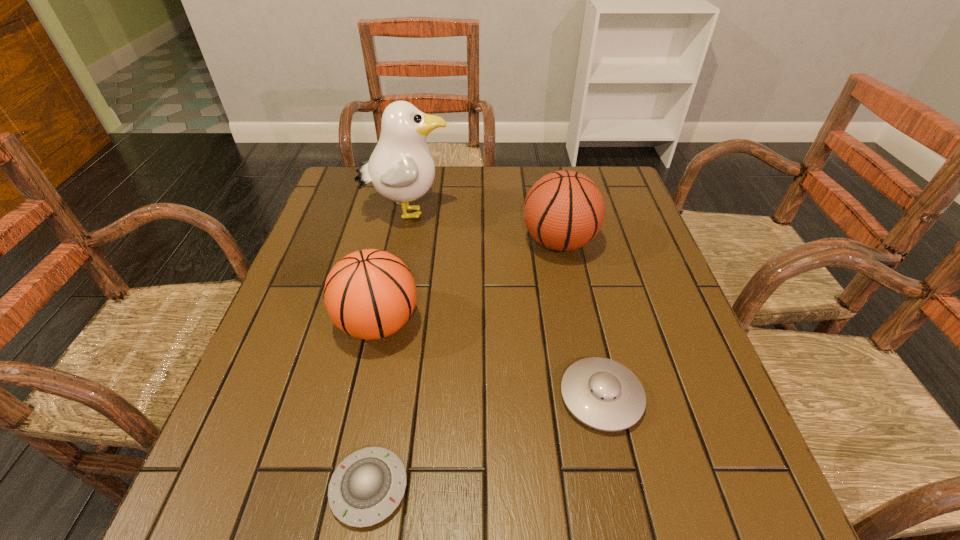
Where is `gull`? gull is located at coordinates (401, 168).

This screenshot has height=540, width=960. Identify the location of the farther basketball. (564, 210).

I want to click on the nearer basketball, so click(x=369, y=294).

Find the location of a particular element. The height and width of the screenshot is (540, 960). the third farthest object is located at coordinates (369, 294).

You are a GUI agent. You are given a task and a screenshot of the screen. Output one action in this format:
    pyautogui.click(x=<x>, y=<y>)
    Task: Click on the second nearest object
    Image resolution: width=960 pixels, height=540 pixels.
    Given the screenshot: What is the action you would take?
    pyautogui.click(x=603, y=394)

Locate an element on the screen. This screenshot has height=540, width=960. the taller saucer is located at coordinates (603, 394).

Identify the location of the nearer saucer. (372, 481).

The width and height of the screenshot is (960, 540). In order to click on the shorter saucer in this screenshot , I will do `click(372, 481)`.

You are a GUI agent. You are given a task and a screenshot of the screen. Output one action in this format:
    pyautogui.click(x=<x>, y=<y>)
    Task: Click on the free location located 0.350m on the beak of the tallest object
    
    Given the screenshot: What is the action you would take?
    pyautogui.click(x=575, y=213)

This screenshot has width=960, height=540. I want to click on free space located 0.400m on the side where the inflation valve is located, so click(x=368, y=242).